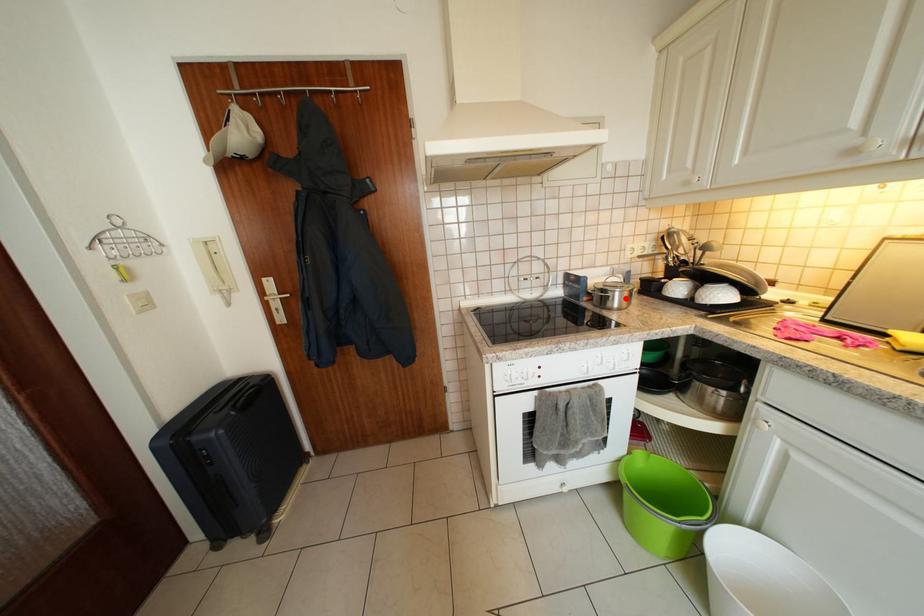
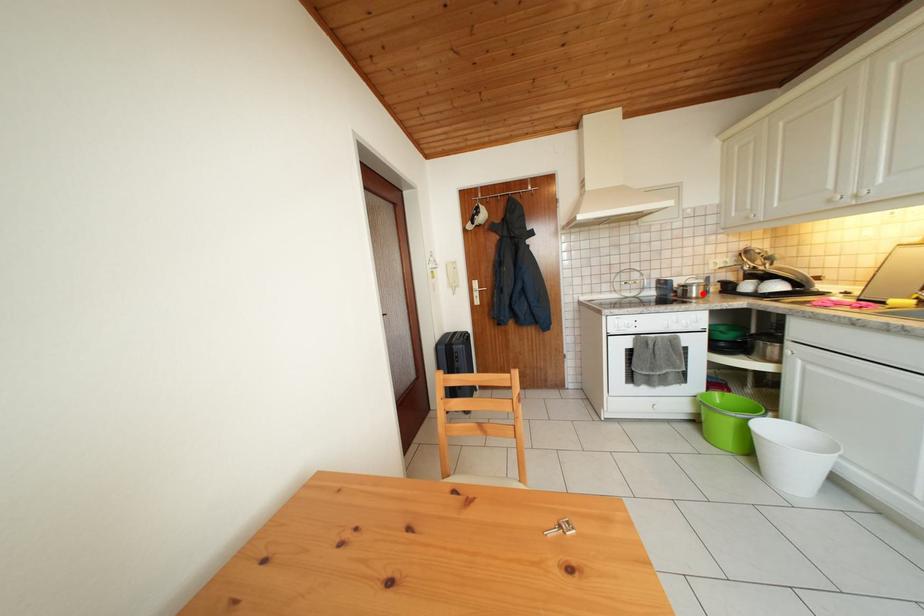
I am providing you with two images of the same scene from different viewpoints. A red point is marked on the first image and another point is marked on the second image. Do the highlighted points in image1 and image2 indicate the same real-world spot?

Yes